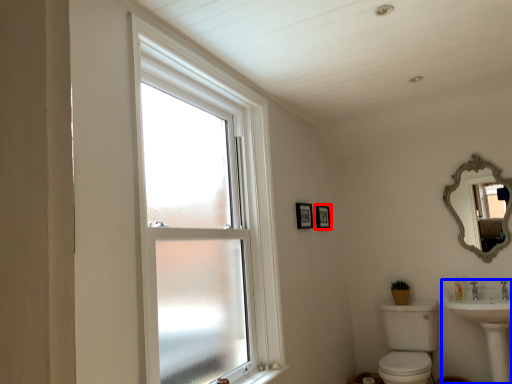
Question: Which of the following is the farthest to the observer, picture frame (highlighted by a red box) or sink (highlighted by a blue box)?

Choices:
 (A) picture frame
 (B) sink

Answer: (A)